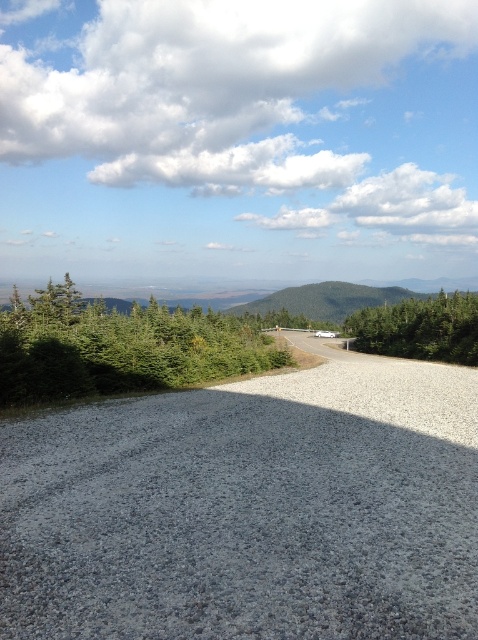
Question: Can you confirm if green textured tree at left is positioned to the right of green textured tree at right?

Choices:
 (A) yes
 (B) no

Answer: (B)

Question: Which object is the closest to the green textured tree at right?

Choices:
 (A) green textured tree at left
 (B) green grassy hill at center

Answer: (A)

Question: Which point appears closest to the camera in this image?

Choices:
 (A) (395, 317)
 (B) (13, 336)
 (C) (305, 371)
 (D) (359, 300)

Answer: (B)

Question: Is gray gravel road at center to the left of green textured tree at right from the viewer's perspective?

Choices:
 (A) no
 (B) yes

Answer: (B)

Question: Does green textured tree at right appear on the left side of green grassy hill at center?

Choices:
 (A) no
 (B) yes

Answer: (A)

Question: Which object is positioned farthest from the green textured tree at right?

Choices:
 (A) green textured tree at left
 (B) gray gravel road at center
 (C) green grassy hill at center

Answer: (B)